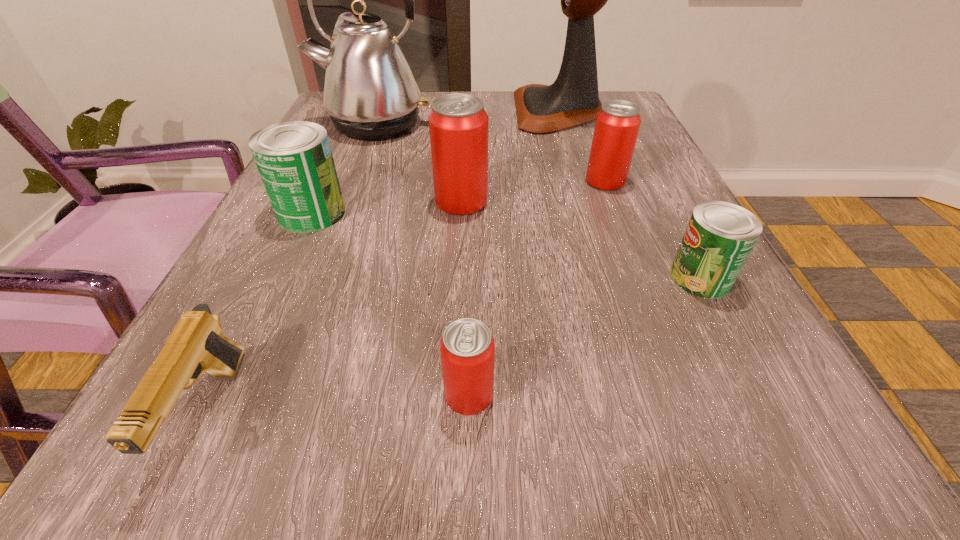
Identify which red can is the second closest to the smaller green can. Please provide its 2D coordinates. Your answer should be formatted as a tuple, i.e. [(x, y)], where the tuple contains the x and y coordinates of a point satisfying the conditions above.

[(458, 124)]

Select which red can appears as the closest to the smallest red can. Please provide its 2D coordinates. Your answer should be formatted as a tuple, i.e. [(x, y)], where the tuple contains the x and y coordinates of a point satisfying the conditions above.

[(458, 124)]

Identify the location of vacant space that satisfies the following two spatial constraints: 1. from the spout of the second can from right to left; 2. on the left side of the kettle. (352, 181).